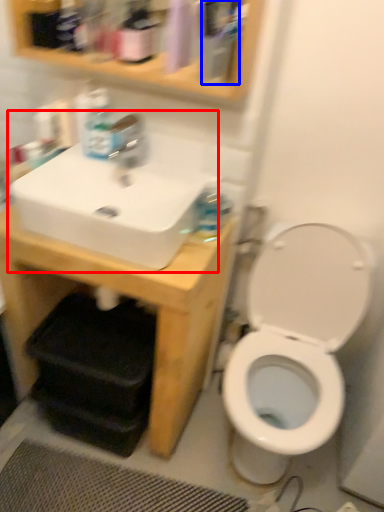
Question: Among these objects, which one is nearest to the camera, sink (highlighted by a red box) or mouthwash (highlighted by a blue box)?

Choices:
 (A) sink
 (B) mouthwash

Answer: (B)